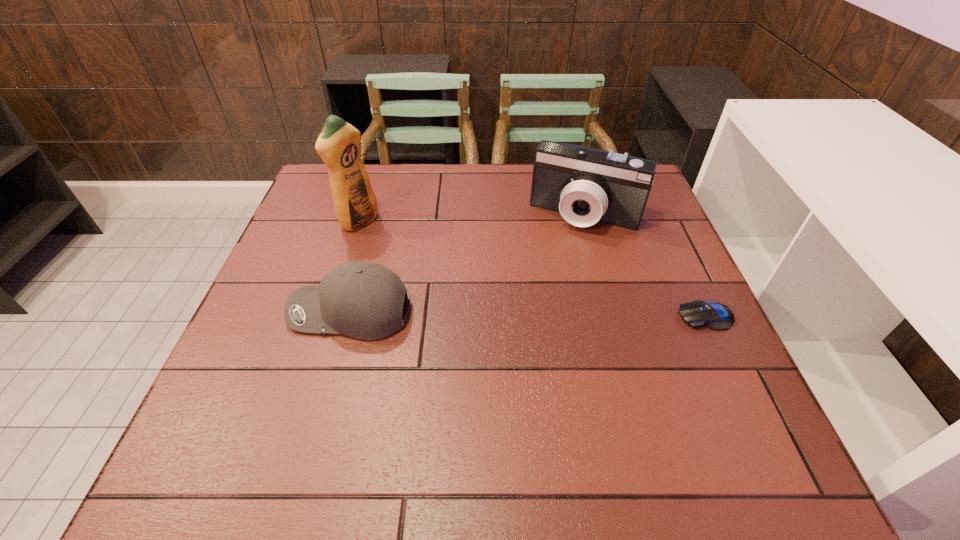
At what (x,y) coordinates should I click in order to perform the action: click on free space between the tallest object and the computer mouse. Please return your answer as a coordinate pair (x, y). Looking at the image, I should click on (533, 269).

Where is `free spot between the second tallest object and the second shortest object`? The height and width of the screenshot is (540, 960). free spot between the second tallest object and the second shortest object is located at coordinates (468, 264).

Where is `free space that is in between the baseball cap and the shortest object`? This screenshot has height=540, width=960. free space that is in between the baseball cap and the shortest object is located at coordinates (528, 314).

Locate which object is the second closest to the baseball cap. Please provide its 2D coordinates. Your answer should be formatted as a tuple, i.e. [(x, y)], where the tuple contains the x and y coordinates of a point satisfying the conditions above.

[(585, 185)]

Find the location of a particular element. The width and height of the screenshot is (960, 540). object identified as the third closest to the shortest object is located at coordinates (x=339, y=144).

Where is `free space that satisfies the following two spatial constraints: 1. on the front side of the shortest object; 2. on the button side of the camcorder`? The height and width of the screenshot is (540, 960). free space that satisfies the following two spatial constraints: 1. on the front side of the shortest object; 2. on the button side of the camcorder is located at coordinates (612, 316).

Locate an element on the screen. free space in the image that satisfies the following two spatial constraints: 1. on the front side of the second shortest object; 2. on the front brim of the detergent is located at coordinates (331, 312).

You are a GUI agent. You are given a task and a screenshot of the screen. Output one action in this format:
    pyautogui.click(x=<x>, y=<y>)
    Task: Click on the blank area in the image that satisfies the following two spatial constraints: 1. on the front side of the computer mouse; 2. on the button side of the second tallest object
    
    Given the screenshot: What is the action you would take?
    pyautogui.click(x=612, y=316)

Find the location of `free space that satisfies the following two spatial constraints: 1. on the front side of the tallest object; 2. on the button side of the shortest object`. free space that satisfies the following two spatial constraints: 1. on the front side of the tallest object; 2. on the button side of the shortest object is located at coordinates (330, 316).